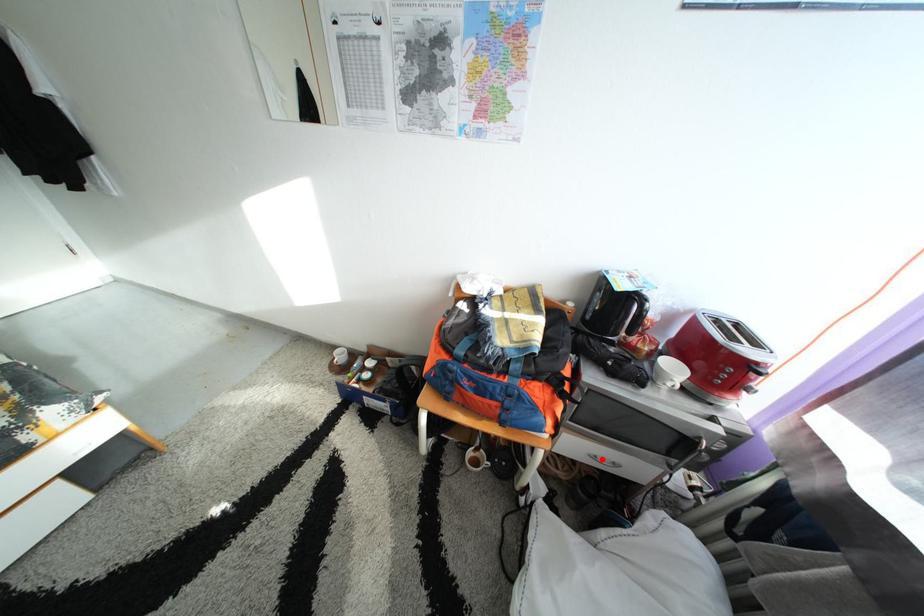
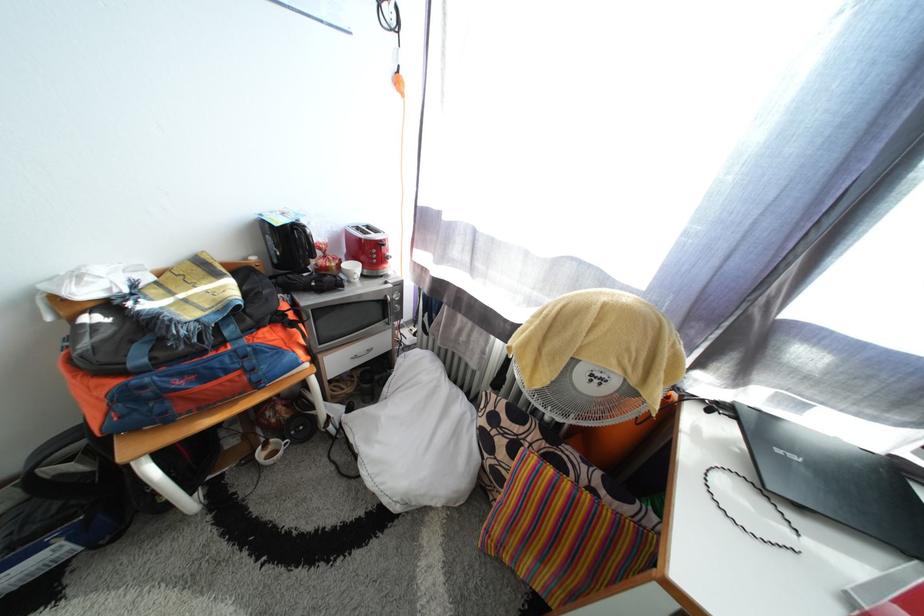
The point at the highlighted location is marked in the first image. Where is the corresponding point in the second image?

(361, 361)